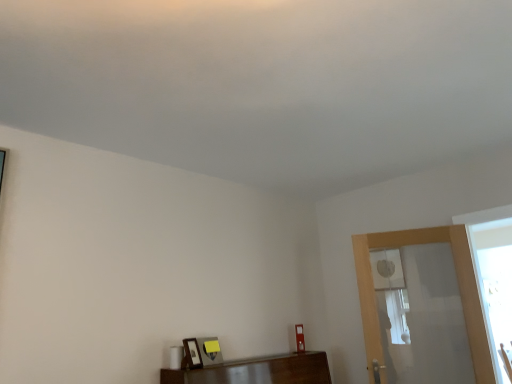
Question: Is point (202, 365) positioned closer to the camera than point (471, 281)?

Choices:
 (A) farther
 (B) closer

Answer: (B)

Question: From the image's perspective, is wooden picture frame at lower center positioned above or below clear glass screen door at right?

Choices:
 (A) above
 (B) below

Answer: (B)

Question: Is wooden picture frame at lower center to the left or to the right of clear glass screen door at right in the image?

Choices:
 (A) left
 (B) right

Answer: (A)

Question: In terms of height, does clear glass screen door at right look taller or shorter compared to wooden picture frame at lower center?

Choices:
 (A) tall
 (B) short

Answer: (A)

Question: From the image's perspective, is clear glass screen door at right above or below wooden picture frame at lower center?

Choices:
 (A) below
 (B) above

Answer: (B)

Question: Is clear glass screen door at right to the left or to the right of wooden picture frame at lower center in the image?

Choices:
 (A) left
 (B) right

Answer: (B)

Question: Is clear glass screen door at right inside the boundaries of wooden picture frame at lower center, or outside?

Choices:
 (A) inside
 (B) outside

Answer: (B)